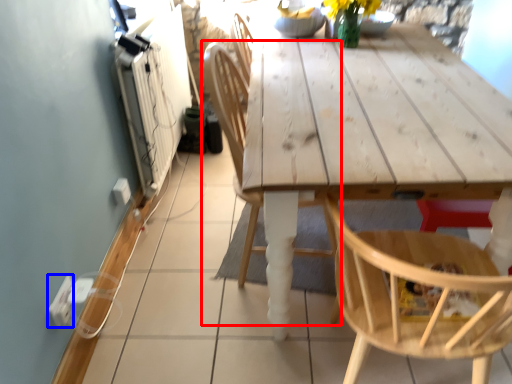
Question: Which object is further to the camera taking this photo, chair (highlighted by a red box) or electric outlet (highlighted by a blue box)?

Choices:
 (A) chair
 (B) electric outlet

Answer: (B)